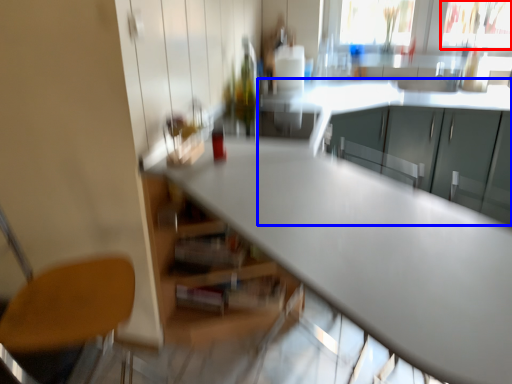
Question: Which of the following is the farthest to the observer, window screen (highlighted by a red box) or cabinetry (highlighted by a blue box)?

Choices:
 (A) window screen
 (B) cabinetry

Answer: (A)